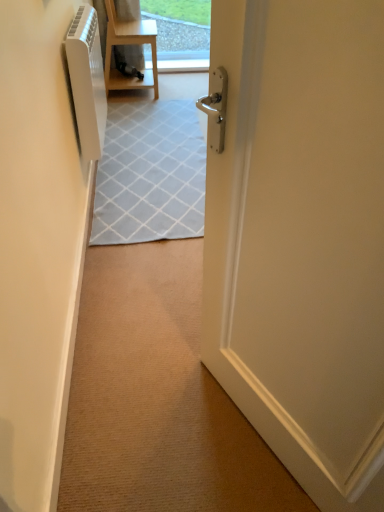
You are a GUI agent. You are given a task and a screenshot of the screen. Output one action in this format:
    pyautogui.click(x=<x>, y=<y>)
    Task: Click on the white glossy radiator at left
    The image size is (384, 512).
    Given the screenshot: What is the action you would take?
    pyautogui.click(x=37, y=249)

Locate an element on the screen. This screenshot has width=384, height=512. white plastic air conditioner at left is located at coordinates (87, 81).

Where is `door that is below the light wood/matte chair at upper center (from the image's perspective)`? door that is below the light wood/matte chair at upper center (from the image's perspective) is located at coordinates (301, 238).

In the scene shown: Is light wood/matte chair at upper center facing away from white glossy door at center?

No, light wood/matte chair at upper center is not facing away from white glossy door at center.

From the image's perspective, which is above, light wood/matte chair at upper center or white glossy door at center?

light wood/matte chair at upper center appears higher in the image.

Can you tell me how much white glossy door at center and white plastic air conditioner at left differ in facing direction?

0.26 degrees separate the facing orientations of white glossy door at center and white plastic air conditioner at left.

Which is behind, point (208, 136) or point (88, 60)?

The point (88, 60) is behind.

Consider the image. Is white glossy door at center turned away from white plastic air conditioner at left?

No, white glossy door at center's orientation is not away from white plastic air conditioner at left.

Does white glossy door at center appear on the right side of white plastic air conditioner at left?

Yes, white glossy door at center is to the right of white plastic air conditioner at left.

Where is `furniture positioned vertically above the white glossy door at center (from a real-world perspective)`? The height and width of the screenshot is (512, 384). furniture positioned vertically above the white glossy door at center (from a real-world perspective) is located at coordinates coord(129,44).

From the image's perspective, which one is positioned higher, white glossy door at center or light wood/matte chair at upper center?

From the image's view, light wood/matte chair at upper center is above.

Does point (206, 220) lie in front of point (116, 41)?

Yes.

Is white glossy door at center positioned behind light wood/matte chair at upper center?

That is False.

From a real-world perspective, between white plastic air conditioner at left and light wood/matte chair at upper center, who is vertically lower?

From a 3D spatial view, light wood/matte chair at upper center is below.

From the image's perspective, would you say white plastic air conditioner at left is shown under light wood/matte chair at upper center?

Correct, white plastic air conditioner at left appears lower than light wood/matte chair at upper center in the image.

How many degrees apart are the facing directions of white plastic air conditioner at left and light wood/matte chair at upper center?

white plastic air conditioner at left and light wood/matte chair at upper center are facing 0.682 degrees away from each other.

Considering the relative positions of white plastic air conditioner at left and light wood/matte chair at upper center in the image provided, is white plastic air conditioner at left to the left or to the right of light wood/matte chair at upper center?

Based on their positions, white plastic air conditioner at left is located to the left of light wood/matte chair at upper center.

Who is shorter, white glossy radiator at left or white plastic air conditioner at left?

Standing shorter between the two is white glossy radiator at left.

Does point (24, 424) appear closer or farther from the camera than point (103, 136)?

Point (24, 424) is positioned closer to the camera compared to point (103, 136).

Does white glossy radiator at left have a greater width compared to white plastic air conditioner at left?

Incorrect, the width of white glossy radiator at left does not surpass that of white plastic air conditioner at left.

Is white glossy radiator at left in contact with light wood/matte chair at upper center?

white glossy radiator at left and light wood/matte chair at upper center are clearly separated.

From the image's perspective, who appears lower, white glossy radiator at left or light wood/matte chair at upper center?

white glossy radiator at left appears lower in the image.

Which is behind, point (62, 69) or point (125, 82)?

Point (125, 82)

In the scene shown: Between white glossy radiator at left and light wood/matte chair at upper center, which one has smaller size?

white glossy radiator at left.

From the image's perspective, is white glossy radiator at left below white glossy door at center?

Indeed, from the image's perspective, white glossy radiator at left is shown beneath white glossy door at center.

Can you confirm if white glossy radiator at left is thinner than white glossy door at center?

Correct, the width of white glossy radiator at left is less than that of white glossy door at center.

Between white glossy radiator at left and white glossy door at center, which one has smaller size?

With smaller size is white glossy radiator at left.

Is white glossy radiator at left looking in the opposite direction of white glossy door at center?

No, white glossy radiator at left's orientation is not away from white glossy door at center.

Where is `door directly beneath the light wood/matte chair at upper center (from a real-world perspective)`? This screenshot has width=384, height=512. door directly beneath the light wood/matte chair at upper center (from a real-world perspective) is located at coordinates (301, 238).

The width and height of the screenshot is (384, 512). Find the location of `air conditioner positioned vertically above the white glossy door at center (from a real-world perspective)`. air conditioner positioned vertically above the white glossy door at center (from a real-world perspective) is located at coordinates (87, 81).

Based on their spatial positions, is white glossy radiator at left or white plastic air conditioner at left further from white glossy door at center?

The object further to white glossy door at center is white plastic air conditioner at left.

From the image, which object appears to be farther from light wood/matte chair at upper center, white plastic air conditioner at left or white glossy door at center?

white glossy door at center.

Estimate the real-world distances between objects in this image. Which object is closer to white glossy door at center, light wood/matte chair at upper center or white plastic air conditioner at left?

white plastic air conditioner at left is closer to white glossy door at center.

In the scene shown: From the image, which object appears to be nearer to white plastic air conditioner at left, white glossy door at center or white glossy radiator at left?

white glossy radiator at left is positioned closer to the anchor white plastic air conditioner at left.

Looking at the image, which one is located closer to white plastic air conditioner at left, white glossy radiator at left or white glossy door at center?

white glossy radiator at left lies closer to white plastic air conditioner at left than the other object.

Considering their positions, is white plastic air conditioner at left positioned closer to white glossy radiator at left than white glossy door at center?

white plastic air conditioner at left is positioned closer to the anchor white glossy radiator at left.

Based on their spatial positions, is white glossy door at center or light wood/matte chair at upper center closer to white plastic air conditioner at left?

light wood/matte chair at upper center is closer to white plastic air conditioner at left.

From the image, which object appears to be nearer to light wood/matte chair at upper center, white glossy door at center or white plastic air conditioner at left?

Among the two, white plastic air conditioner at left is located nearer to light wood/matte chair at upper center.

Identify the location of door located between white glossy radiator at left and white plastic air conditioner at left in the depth direction. (301, 238).

What are the coordinates of `door between white glossy radiator at left and light wood/matte chair at upper center in the front-back direction` in the screenshot? It's located at (301, 238).

You are a GUI agent. You are given a task and a screenshot of the screen. Output one action in this format:
    pyautogui.click(x=<x>, y=<y>)
    Task: Click on the air conditioner between white glossy radiator at left and light wood/matte chair at upper center along the z-axis
    
    Given the screenshot: What is the action you would take?
    pyautogui.click(x=87, y=81)

You are a GUI agent. You are given a task and a screenshot of the screen. Output one action in this format:
    pyautogui.click(x=<x>, y=<y>)
    Task: Click on the air conditioner between white glossy door at center and light wood/matte chair at upper center in the front-back direction
    Image resolution: width=384 pixels, height=512 pixels.
    Given the screenshot: What is the action you would take?
    pyautogui.click(x=87, y=81)